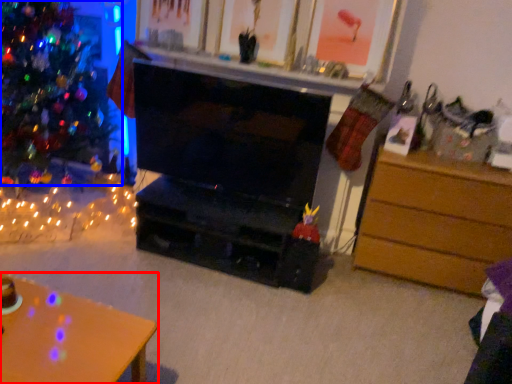
Question: Which of the following is the closest to the observer, desk (highlighted by a red box) or christmas tree (highlighted by a blue box)?

Choices:
 (A) desk
 (B) christmas tree

Answer: (A)